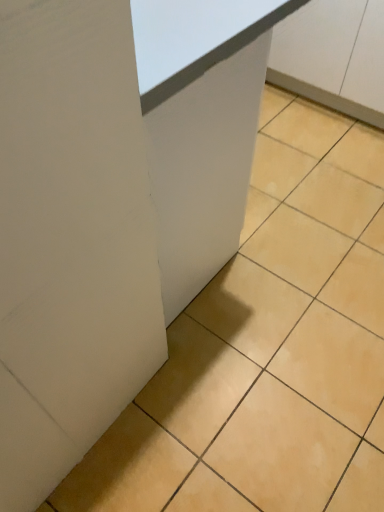
Question: Can you confirm if white matte cabinet at center is shorter than white matte cabinet at upper right?

Choices:
 (A) yes
 (B) no

Answer: (B)

Question: Does white matte cabinet at center have a greater height compared to white matte cabinet at upper right?

Choices:
 (A) no
 (B) yes

Answer: (B)

Question: Is white matte cabinet at center to the left of white matte cabinet at upper right from the viewer's perspective?

Choices:
 (A) yes
 (B) no

Answer: (A)

Question: Does white matte cabinet at center turn towards white matte cabinet at upper right?

Choices:
 (A) yes
 (B) no

Answer: (A)

Question: Does white matte cabinet at center lie in front of white matte cabinet at upper right?

Choices:
 (A) yes
 (B) no

Answer: (A)

Question: Considering the relative sizes of white matte cabinet at center and white matte cabinet at upper right in the image provided, is white matte cabinet at center wider than white matte cabinet at upper right?

Choices:
 (A) no
 (B) yes

Answer: (A)

Question: Is white matte cabinet at upper right positioned in front of white matte cabinet at center?

Choices:
 (A) no
 (B) yes

Answer: (A)

Question: From the image's perspective, would you say white matte cabinet at upper right is positioned over white matte cabinet at center?

Choices:
 (A) no
 (B) yes

Answer: (B)

Question: Can you confirm if white matte cabinet at upper right is taller than white matte cabinet at center?

Choices:
 (A) no
 (B) yes

Answer: (A)

Question: Considering the relative sizes of white matte cabinet at upper right and white matte cabinet at center in the image provided, is white matte cabinet at upper right thinner than white matte cabinet at center?

Choices:
 (A) yes
 (B) no

Answer: (B)

Question: Is white matte cabinet at upper right wider than white matte cabinet at center?

Choices:
 (A) yes
 (B) no

Answer: (A)

Question: From a real-world perspective, is white matte cabinet at upper right physically below white matte cabinet at center?

Choices:
 (A) yes
 (B) no

Answer: (A)

Question: Is point (235, 68) closer or farther from the camera than point (377, 31)?

Choices:
 (A) closer
 (B) farther

Answer: (A)